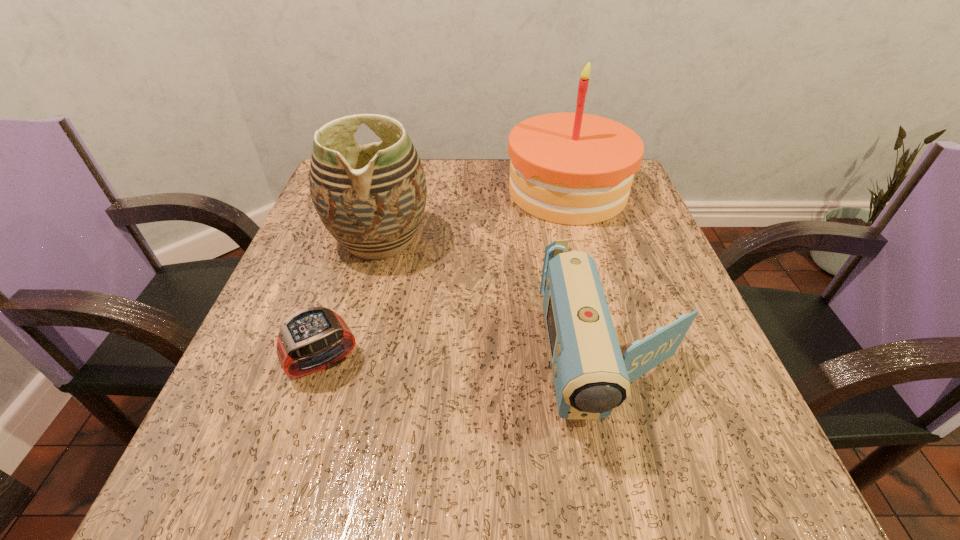
Locate an element on the screen. Image resolution: width=960 pixels, height=540 pixels. vacant space that's between the watch and the pottery is located at coordinates (351, 301).

The image size is (960, 540). In order to click on free space between the watch and the pottery in this screenshot , I will do [x=351, y=301].

Identify which object is the nearest to the tallest object. Please provide its 2D coordinates. Your answer should be formatted as a tuple, i.e. [(x, y)], where the tuple contains the x and y coordinates of a point satisfying the conditions above.

[(371, 198)]

Find the location of `object that is the second closest to the camcorder`. object that is the second closest to the camcorder is located at coordinates (568, 168).

Identify the location of vacant area that satisfies the following two spatial constraints: 1. on the back side of the tallest object; 2. on the right side of the pottery. (393, 191).